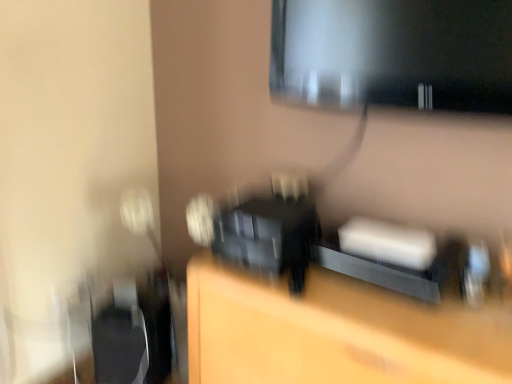
Question: Considering the relative sizes of matte black monitor at upper right and matte black speaker at center in the image provided, is matte black monitor at upper right smaller than matte black speaker at center?

Choices:
 (A) no
 (B) yes

Answer: (B)

Question: Does matte black monitor at upper right have a greater height compared to matte black speaker at center?

Choices:
 (A) no
 (B) yes

Answer: (A)

Question: Is matte black monitor at upper right positioned beyond the bounds of matte black speaker at center?

Choices:
 (A) no
 (B) yes

Answer: (B)

Question: Is matte black monitor at upper right in contact with matte black speaker at center?

Choices:
 (A) yes
 (B) no

Answer: (B)

Question: From a real-world perspective, does matte black monitor at upper right sit lower than matte black speaker at center?

Choices:
 (A) no
 (B) yes

Answer: (A)

Question: Looking at the image, does matte black monitor at upper right seem bigger or smaller compared to black plastic swivel chair at left?

Choices:
 (A) big
 (B) small

Answer: (B)

Question: In terms of height, does matte black monitor at upper right look taller or shorter compared to black plastic swivel chair at left?

Choices:
 (A) short
 (B) tall

Answer: (A)

Question: Is matte black monitor at upper right wider or thinner than black plastic swivel chair at left?

Choices:
 (A) wide
 (B) thin

Answer: (B)

Question: Relative to black plastic swivel chair at left, is matte black monitor at upper right in front or behind?

Choices:
 (A) behind
 (B) front

Answer: (B)

Question: Considering their positions, is matte black speaker at center located in front of or behind matte black monitor at upper right?

Choices:
 (A) front
 (B) behind

Answer: (A)

Question: Does point (211, 294) appear closer or farther from the camera than point (419, 57)?

Choices:
 (A) farther
 (B) closer

Answer: (A)

Question: From a real-world perspective, relative to matte black monitor at upper right, is matte black speaker at center vertically above or below?

Choices:
 (A) above
 (B) below

Answer: (B)

Question: Is matte black speaker at center to the left or to the right of matte black monitor at upper right in the image?

Choices:
 (A) right
 (B) left

Answer: (B)

Question: Considering the positions of black plastic swivel chair at left and matte black speaker at center in the image, is black plastic swivel chair at left taller or shorter than matte black speaker at center?

Choices:
 (A) tall
 (B) short

Answer: (B)

Question: In the image, is black plastic swivel chair at left on the left side or the right side of matte black speaker at center?

Choices:
 (A) left
 (B) right

Answer: (A)